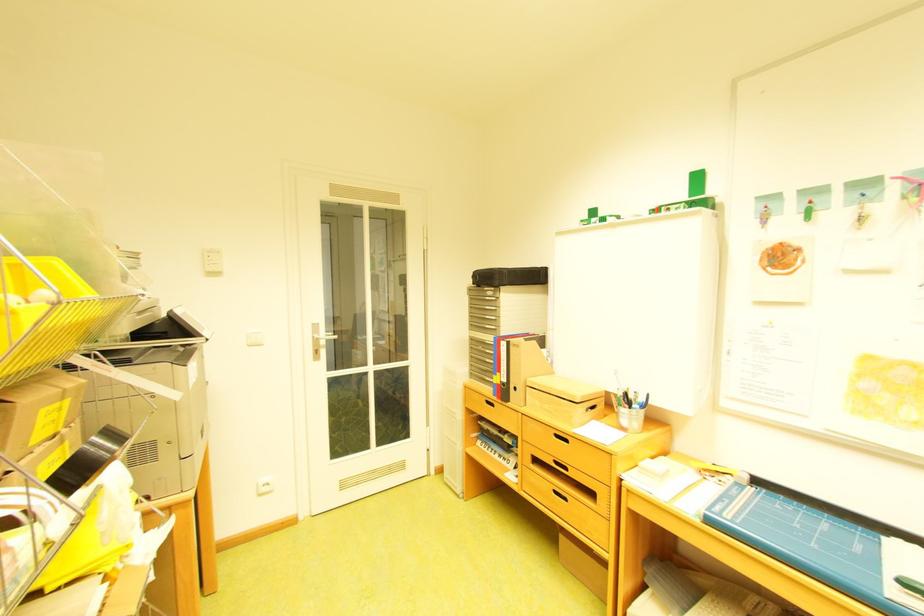
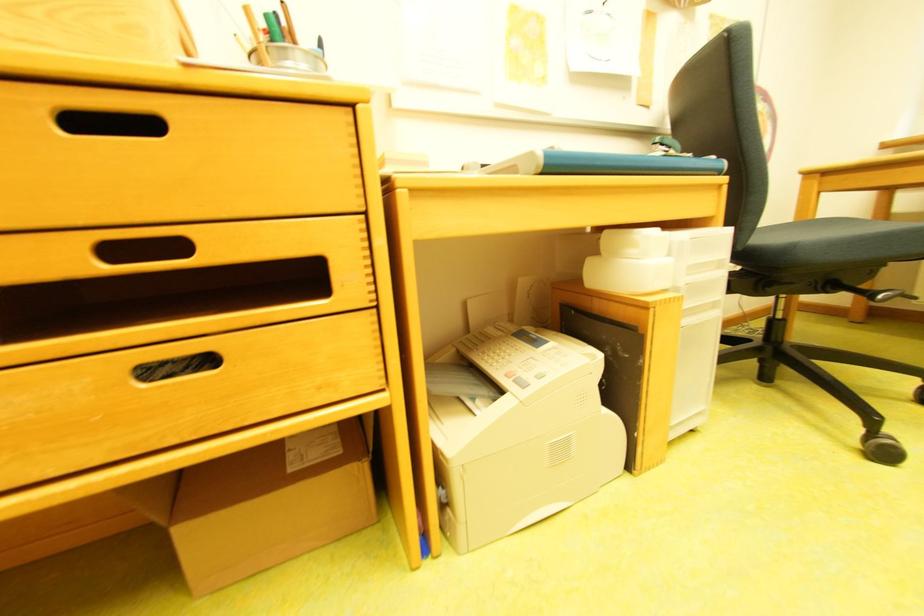
Find the pixel in the second image that matches [566,493] in the first image.

(162, 374)